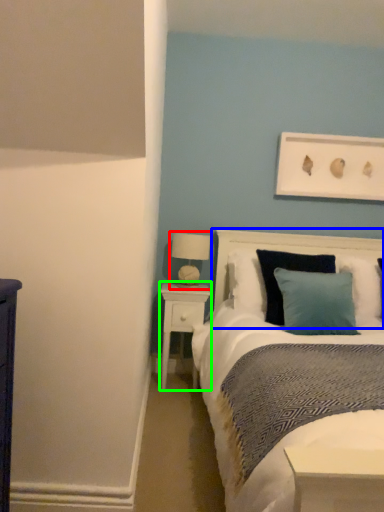
Question: Based on their relative distances, which object is nearer to table lamp (highlighted by a red box)? Choose from headboard (highlighted by a blue box) and nightstand (highlighted by a green box).

Choices:
 (A) headboard
 (B) nightstand

Answer: (B)